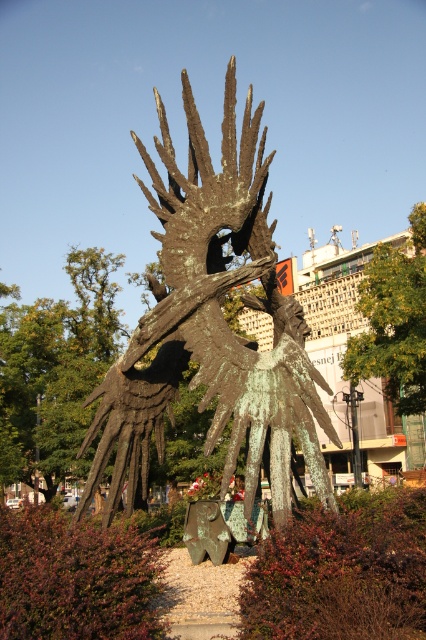
You are an art student standing in front of the green patina metal sculpture at center and the green patina sculpture at center. Your teacher asks you to compare their heights. Which one is taller?

The green patina metal sculpture at center is taller than the green patina sculpture at center according to the description.